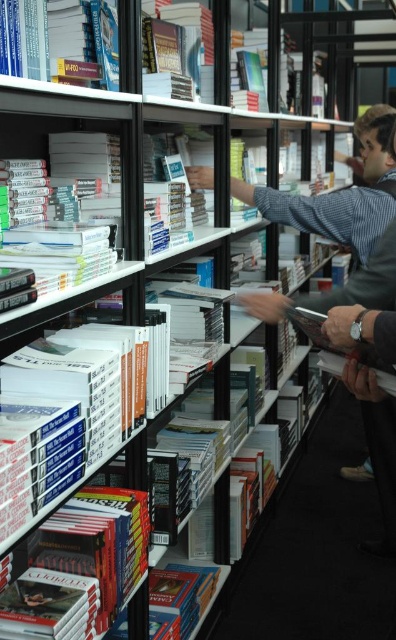
Question: Which object is positioned closest to the hardcover book at lower left?

Choices:
 (A) hardcover book at center
 (B) hardcover book at upper center
 (C) hardcover book at lower center

Answer: (C)

Question: Which of the following is the closest to the observer?

Choices:
 (A) hardcover book at lower center
 (B) hardcover book at upper left
 (C) white glossy book at left

Answer: (B)

Question: Where is white glossy book at left located in relation to hardcover book at upper center in the image?

Choices:
 (A) right
 (B) left

Answer: (B)

Question: Does white glossy book at left lie in front of hardcover book at lower left?

Choices:
 (A) no
 (B) yes

Answer: (B)

Question: Can you confirm if hardcover book at lower left is positioned to the right of hardcover book at upper left?

Choices:
 (A) yes
 (B) no

Answer: (A)

Question: Among these points, which one is nearest to the camera?

Choices:
 (A) (100, 554)
 (B) (150, 588)

Answer: (A)